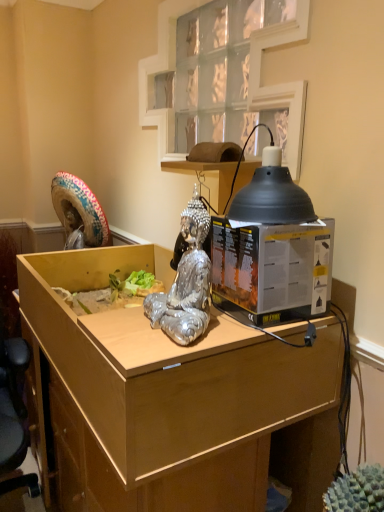
Question: Looking at their shapes, would you say matte black desktop computer at center is wider or thinner than shiny silver statue at center?

Choices:
 (A) wide
 (B) thin

Answer: (A)

Question: Is matte black desktop computer at center in front of or behind shiny silver statue at center in the image?

Choices:
 (A) front
 (B) behind

Answer: (B)

Question: Estimate the real-world distances between objects in this image. Which object is farther from the matte black desktop computer at center?

Choices:
 (A) shiny silver statue at center
 (B) black matte lampshade at upper right
 (C) wooden desk at center

Answer: (C)

Question: Based on their relative distances, which object is nearer to the shiny silver statue at center?

Choices:
 (A) matte black desktop computer at center
 (B) wooden desk at center
 (C) black matte lampshade at upper right

Answer: (A)